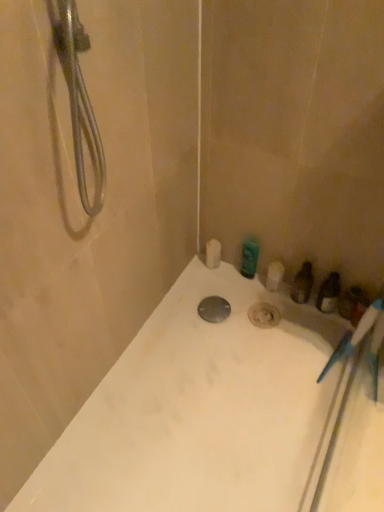
I want to click on free space to the left of white matte toilet paper at upper center, so click(188, 276).